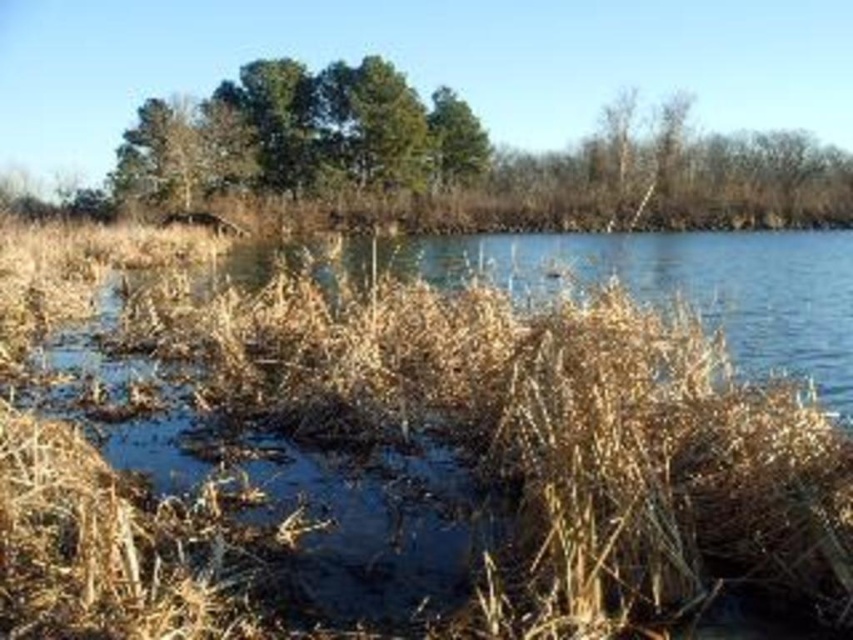
Which is behind, point (146, 605) or point (167, 170)?

The point (167, 170) is behind.

Between brown grassy river at center and green leafy trees at upper center, which one is positioned lower?

Positioned lower is brown grassy river at center.

Between point (427, 412) and point (444, 120), which one is positioned behind?

Point (444, 120)

Where is `brown grassy river at center`? The width and height of the screenshot is (853, 640). brown grassy river at center is located at coordinates (415, 438).